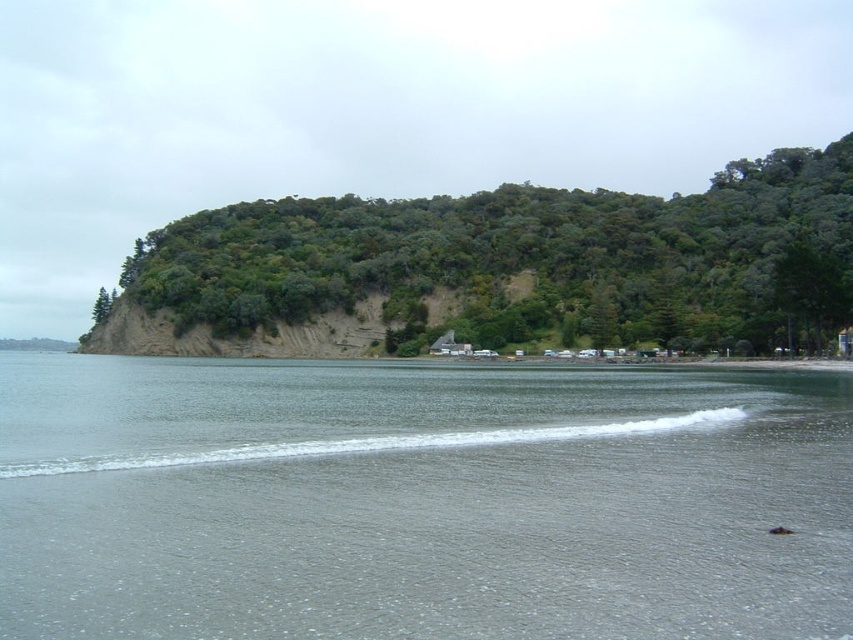
This screenshot has height=640, width=853. What do you see at coordinates (421, 500) in the screenshot? I see `gray water at lower center` at bounding box center [421, 500].

Who is higher up, gray water at lower center or green leafy hillside at upper center?

green leafy hillside at upper center is above.

Is point (790, 596) less distant than point (555, 224)?

Yes, it is in front of point (555, 224).

This screenshot has height=640, width=853. What are the coordinates of `gray water at lower center` in the screenshot? It's located at (421, 500).